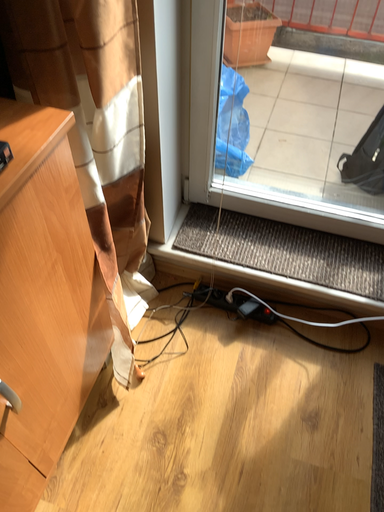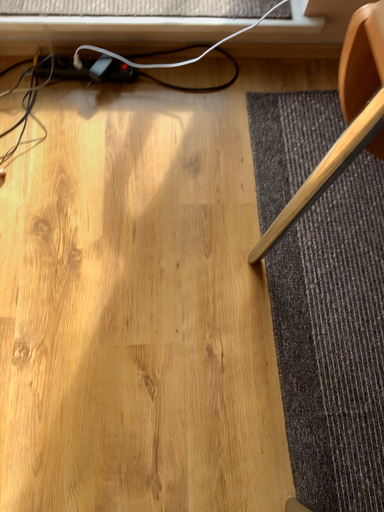
Question: How did the camera likely rotate when shooting the video?

Choices:
 (A) rotated right
 (B) rotated left

Answer: (A)